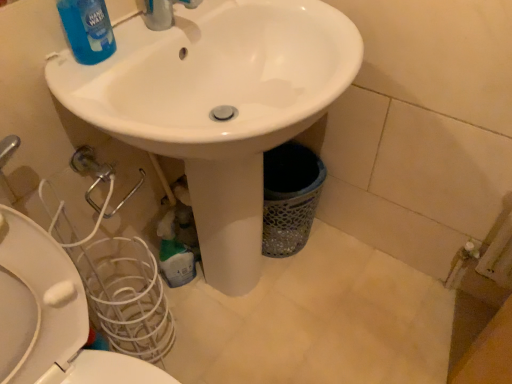
Where is `green plastic bottle at lower center, the 2th cleaning product viewed from the front`? Image resolution: width=512 pixels, height=384 pixels. green plastic bottle at lower center, the 2th cleaning product viewed from the front is located at coordinates pyautogui.click(x=174, y=253).

Describe the element at coordinates (218, 106) in the screenshot. This screenshot has height=384, width=512. I see `white glossy sink at center` at that location.

At what (x,y) coordinates should I click in order to perform the action: click on white glossy sink at center. Please return your answer as a coordinate pair (x, y). This screenshot has height=384, width=512. Looking at the image, I should click on (218, 106).

Identify the location of green plastic bottle at lower center, placed as the 2th cleaning product when sorted from top to bottom. (174, 253).

Is point (356, 59) behind point (165, 257)?

No, it is not.

Considering the positions of objects white glossy sink at center and green plastic bottle at lower center, placed as the 2th cleaning product when sorted from top to bottom, in the image provided, who is behind, white glossy sink at center or green plastic bottle at lower center, placed as the 2th cleaning product when sorted from top to bottom,?

green plastic bottle at lower center, placed as the 2th cleaning product when sorted from top to bottom, is more distant.

How far apart are white glossy sink at center and green plastic bottle at lower center, placed as the 2th cleaning product when sorted from top to bottom?

white glossy sink at center and green plastic bottle at lower center, placed as the 2th cleaning product when sorted from top to bottom, are 16.19 inches apart.

From the image's perspective, between white glossy sink at center and green plastic bottle at lower center, which appears as the 1th cleaning product when viewed from the back, which one is located above?

white glossy sink at center, from the image's perspective.

Based on the photo, from a real-world perspective, is white glossy toilet at lower left positioned under blue glossy liquid at upper left, which ranks as the 1th cleaning product in top-to-bottom order, based on gravity?

Yes, from a real-world perspective, white glossy toilet at lower left is beneath blue glossy liquid at upper left, which ranks as the 1th cleaning product in top-to-bottom order.

Is white glossy toilet at lower left inside the boundaries of blue glossy liquid at upper left, the second cleaning product when ordered from back to front, or outside?

white glossy toilet at lower left is not inside blue glossy liquid at upper left, the second cleaning product when ordered from back to front, it's outside.

Is white glossy toilet at lower left positioned behind blue glossy liquid at upper left, the second cleaning product when ordered from back to front?

Yes, it is behind blue glossy liquid at upper left, the second cleaning product when ordered from back to front.

From a real-world perspective, does blue glossy liquid at upper left, which ranks as the 1th cleaning product in top-to-bottom order, stand above white glossy sink at center?

Yes.

From the image's perspective, which object appears higher, blue glossy liquid at upper left, which ranks as the 2th cleaning product in bottom-to-top order, or white glossy sink at center?

blue glossy liquid at upper left, which ranks as the 2th cleaning product in bottom-to-top order, from the image's perspective.

How much distance is there between blue glossy liquid at upper left, the first cleaning product in the front-to-back sequence, and white glossy sink at center?

11.86 inches.

Does blue glossy liquid at upper left, the first cleaning product in the front-to-back sequence, have a greater height compared to white glossy sink at center?

In fact, blue glossy liquid at upper left, the first cleaning product in the front-to-back sequence, may be shorter than white glossy sink at center.

From a real-world perspective, relative to green plastic bottle at lower center, which appears as the 1th cleaning product when viewed from the back, is blue glossy liquid at upper left, the second cleaning product when ordered from back to front, vertically above or below?

Clearly, from a real-world perspective, blue glossy liquid at upper left, the second cleaning product when ordered from back to front, is above green plastic bottle at lower center, which appears as the 1th cleaning product when viewed from the back.

Which of these two, blue glossy liquid at upper left, the second cleaning product when ordered from back to front, or green plastic bottle at lower center, the 2th cleaning product viewed from the front, stands shorter?

blue glossy liquid at upper left, the second cleaning product when ordered from back to front, is shorter.

Considering the positions of objects blue glossy liquid at upper left, the second cleaning product when ordered from back to front, and green plastic bottle at lower center, placed as the 2th cleaning product when sorted from top to bottom, in the image provided, who is in front, blue glossy liquid at upper left, the second cleaning product when ordered from back to front, or green plastic bottle at lower center, placed as the 2th cleaning product when sorted from top to bottom,?

blue glossy liquid at upper left, the second cleaning product when ordered from back to front.

Locate an element on the screen. The width and height of the screenshot is (512, 384). cleaning product that is above the green plastic bottle at lower center, which appears as the 1th cleaning product when viewed from the back (from a real-world perspective) is located at coordinates (87, 29).

Considering the positions of objects white glossy sink at center and blue glossy liquid at upper left, the first cleaning product in the front-to-back sequence, in the image provided, who is more to the left, white glossy sink at center or blue glossy liquid at upper left, the first cleaning product in the front-to-back sequence,?

Positioned to the left is blue glossy liquid at upper left, the first cleaning product in the front-to-back sequence.

Consider the image. Is white glossy sink at center facing towards blue glossy liquid at upper left, which ranks as the 1th cleaning product in top-to-bottom order?

No, white glossy sink at center does not turn towards blue glossy liquid at upper left, which ranks as the 1th cleaning product in top-to-bottom order.

From the image's perspective, which one is positioned lower, white glossy sink at center or blue glossy liquid at upper left, which ranks as the 2th cleaning product in bottom-to-top order?

From the image's view, white glossy sink at center is below.

Which point is more forward, [234,197] or [87,52]?

Positioned in front is point [87,52].

In the scene shown: Between green plastic bottle at lower center, the 2th cleaning product viewed from the front, and white glossy toilet at lower left, which one has less height?

Standing shorter between the two is green plastic bottle at lower center, the 2th cleaning product viewed from the front.

Is white glossy toilet at lower left surrounded by green plastic bottle at lower center, which appears as the 1th cleaning product when viewed from the back?

No.

From the picture: Is green plastic bottle at lower center, placed as the 2th cleaning product when sorted from top to bottom, beside white glossy toilet at lower left?

No.

In the scene shown: Which is more to the right, green plastic bottle at lower center, the first cleaning product from the bottom, or white glossy sink at center?

white glossy sink at center is more to the right.

Which object is wider, green plastic bottle at lower center, placed as the 2th cleaning product when sorted from top to bottom, or white glossy sink at center?

white glossy sink at center is wider.

How different are the orientations of green plastic bottle at lower center, the first cleaning product from the bottom, and white glossy sink at center in degrees?

The facing directions of green plastic bottle at lower center, the first cleaning product from the bottom, and white glossy sink at center are 29 degrees apart.

Does green plastic bottle at lower center, which appears as the 1th cleaning product when viewed from the back, lie behind white glossy sink at center?

Yes.

Locate an element on the screen. The image size is (512, 384). cleaning product lying below the white glossy sink at center (from the image's perspective) is located at coordinates (174, 253).

Image resolution: width=512 pixels, height=384 pixels. I want to click on toilet that appears behind the blue glossy liquid at upper left, which ranks as the 1th cleaning product in top-to-bottom order, so click(x=51, y=316).

Looking at this image, from the image, which object appears to be farther from green plastic bottle at lower center, the 2th cleaning product viewed from the front, blue glossy liquid at upper left, the second cleaning product when ordered from back to front, or white glossy toilet at lower left?

blue glossy liquid at upper left, the second cleaning product when ordered from back to front.

Which object lies nearer to the anchor point green plastic bottle at lower center, the first cleaning product from the bottom, white glossy toilet at lower left or blue glossy liquid at upper left, the second cleaning product when ordered from back to front?

Among the two, white glossy toilet at lower left is located nearer to green plastic bottle at lower center, the first cleaning product from the bottom.

From the picture: Estimate the real-world distances between objects in this image. Which object is closer to white glossy sink at center, blue glossy liquid at upper left, the first cleaning product in the front-to-back sequence, or green plastic bottle at lower center, placed as the 2th cleaning product when sorted from top to bottom?

blue glossy liquid at upper left, the first cleaning product in the front-to-back sequence, lies closer to white glossy sink at center than the other object.

Looking at the image, which one is located closer to blue glossy liquid at upper left, the second cleaning product when ordered from back to front, white glossy toilet at lower left or white glossy sink at center?

white glossy sink at center.

Which object lies further to the anchor point blue glossy liquid at upper left, the second cleaning product when ordered from back to front, green plastic bottle at lower center, placed as the 2th cleaning product when sorted from top to bottom, or white glossy toilet at lower left?

Based on the image, green plastic bottle at lower center, placed as the 2th cleaning product when sorted from top to bottom, appears to be further to blue glossy liquid at upper left, the second cleaning product when ordered from back to front.

Estimate the real-world distances between objects in this image. Which object is closer to blue glossy liquid at upper left, the second cleaning product when ordered from back to front, green plastic bottle at lower center, which appears as the 1th cleaning product when viewed from the back, or white glossy sink at center?

white glossy sink at center lies closer to blue glossy liquid at upper left, the second cleaning product when ordered from back to front, than the other object.

From the image, which object appears to be farther from white glossy toilet at lower left, blue glossy liquid at upper left, which ranks as the 1th cleaning product in top-to-bottom order, or white glossy sink at center?

Among the two, blue glossy liquid at upper left, which ranks as the 1th cleaning product in top-to-bottom order, is located further to white glossy toilet at lower left.

When comparing their distances from white glossy sink at center, does green plastic bottle at lower center, which appears as the 1th cleaning product when viewed from the back, or blue glossy liquid at upper left, the first cleaning product in the front-to-back sequence, seem further?

Based on the image, green plastic bottle at lower center, which appears as the 1th cleaning product when viewed from the back, appears to be further to white glossy sink at center.

Find the location of `cleaning product between white glossy sink at center and green plastic bottle at lower center, the first cleaning product from the bottom, in the front-back direction`. cleaning product between white glossy sink at center and green plastic bottle at lower center, the first cleaning product from the bottom, in the front-back direction is located at coordinates (87, 29).

This screenshot has height=384, width=512. I want to click on toilet positioned between white glossy sink at center and green plastic bottle at lower center, placed as the 2th cleaning product when sorted from top to bottom, from near to far, so click(51, 316).

The width and height of the screenshot is (512, 384). I want to click on cleaning product between blue glossy liquid at upper left, which ranks as the 2th cleaning product in bottom-to-top order, and white glossy toilet at lower left vertically, so click(174, 253).

Image resolution: width=512 pixels, height=384 pixels. Identify the location of sink between blue glossy liquid at upper left, the second cleaning product when ordered from back to front, and white glossy toilet at lower left vertically. (218, 106).